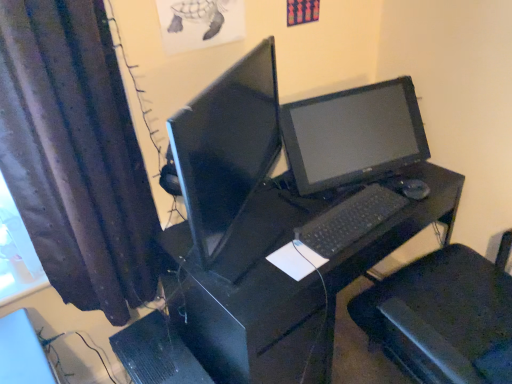
You are a GUI agent. You are given a task and a screenshot of the screen. Output one action in this format:
    pyautogui.click(x=<x>, y=<y>)
    Task: Click on the vacant area to the left of white paper at center
    This screenshot has height=384, width=512.
    Given the screenshot: What is the action you would take?
    pyautogui.click(x=242, y=270)